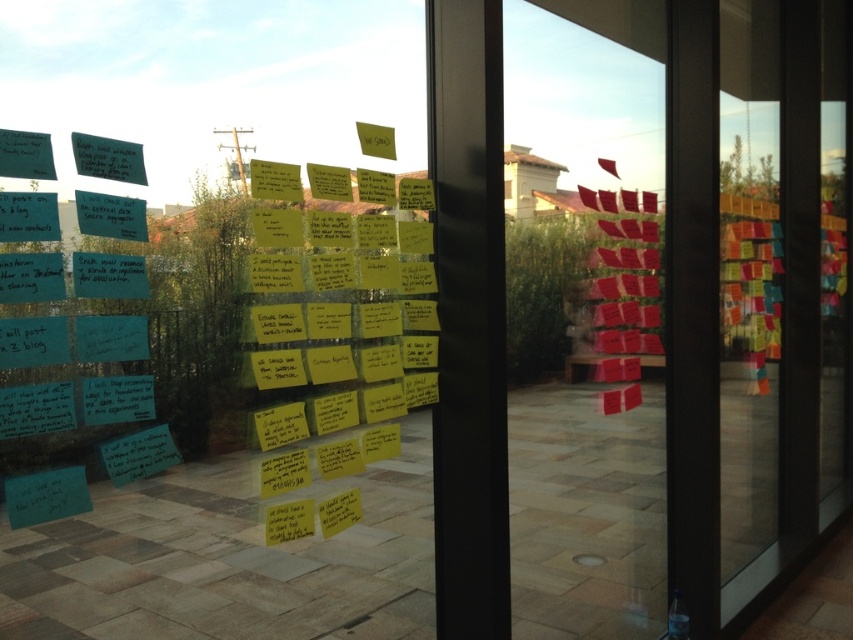
You are an office worker who needs to hang a new sticky note on the transparent glass door at center and the matte paper sign at upper left. Which object will require you to use a step stool to reach it?

The transparent glass door at center is much taller than the matte paper sign at upper left, so you will need a step stool to reach it.

You are an office worker who needs to hang a new sticky note. You have two options to place it either on the transparent glass door at center or the matte paper sign at upper left. Considering their sizes, which object can accommodate a larger sticky note?

The transparent glass door at center can accommodate a larger sticky note because its width is larger than the matte paper sign at upper left.

You are standing in front of the glass wall covered with sticky notes. There are two points marked on the wall at coordinates point (837, 312) and point (91, 161). If you want to touch both points starting from your current position, which point should you reach first?

You should reach point (837, 312) first because it is closer to you than point (91, 161), which is further away.